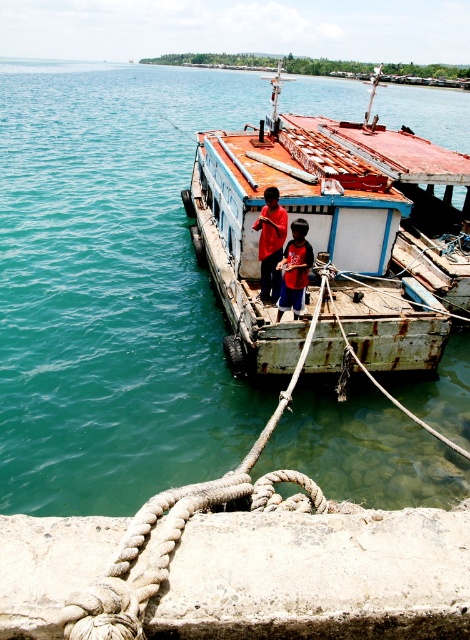
Does rusty concrete ledge at lower center appear on the left side of red cotton shirt at center?

Incorrect, rusty concrete ledge at lower center is not on the left side of red cotton shirt at center.

Does rusty concrete ledge at lower center have a greater width compared to red cotton shirt at center?

Correct, the width of rusty concrete ledge at lower center exceeds that of red cotton shirt at center.

The width and height of the screenshot is (470, 640). What do you see at coordinates (318, 577) in the screenshot? I see `rusty concrete ledge at lower center` at bounding box center [318, 577].

Where is `rusty concrete ledge at lower center`? rusty concrete ledge at lower center is located at coordinates (318, 577).

Is rusty concrete ledge at lower center shorter than rope at center?

No, rusty concrete ledge at lower center is not shorter than rope at center.

Find the location of a particular element. rusty concrete ledge at lower center is located at coordinates (318, 577).

The height and width of the screenshot is (640, 470). Identify the location of rusty concrete ledge at lower center. (318, 577).

The width and height of the screenshot is (470, 640). In order to click on teal water at center in this screenshot , I will do `click(111, 289)`.

Locate an element on the screen. This screenshot has height=640, width=470. teal water at center is located at coordinates (111, 289).